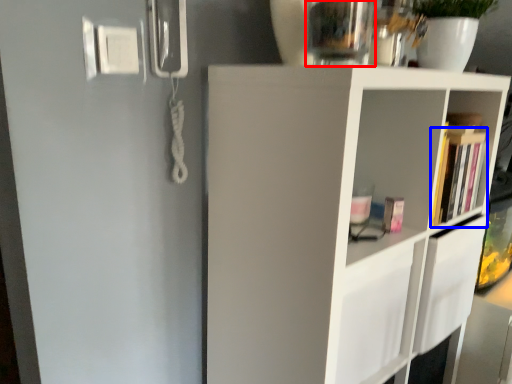
Question: Which object is closer to the camera taking this photo, glass vase (highlighted by a red box) or book (highlighted by a blue box)?

Choices:
 (A) glass vase
 (B) book

Answer: (A)